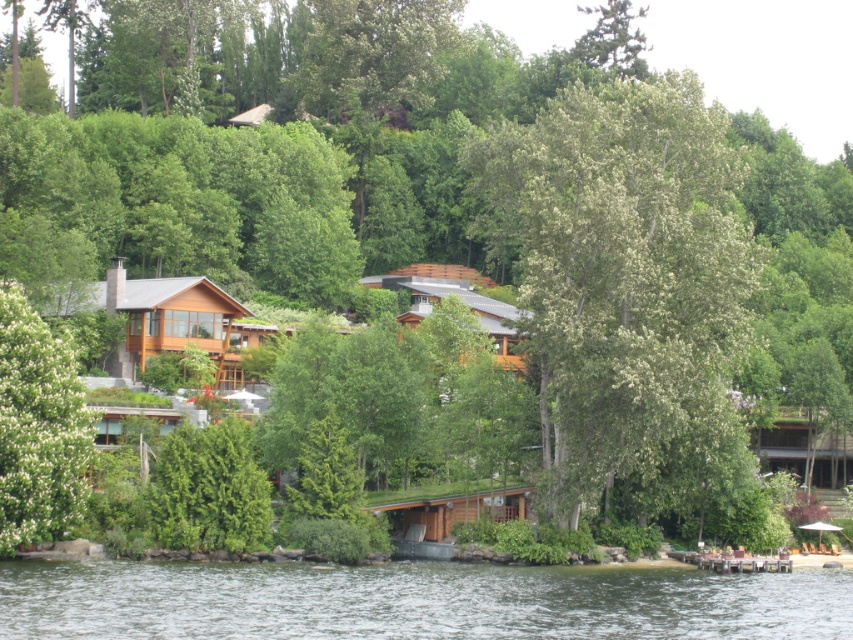
Is point (167, 436) positioned before point (775, 445)?

Yes, it is.

Is point (201, 536) farther from viewer compared to point (811, 461)?

No, (201, 536) is closer to viewer.

Find the location of a particular element. This screenshot has height=640, width=853. green textured tree at center is located at coordinates [209, 490].

Is green leafy tree at left taller than green textured tree at center?

Yes, green leafy tree at left is taller than green textured tree at center.

Can you confirm if green leafy tree at left is smaller than green textured tree at center?

Incorrect, green leafy tree at left is not smaller in size than green textured tree at center.

Measure the distance between point (47, 504) and camera.

The distance of point (47, 504) from camera is 262.12 feet.

What are the coordinates of `green leafy tree at left` in the screenshot? It's located at 38,428.

Is point (682, 566) positioned behind point (784, 413)?

No, it is not.

Who is higher up, dark blue water at lower left or brown wooden hut at lower right?

brown wooden hut at lower right is above.

Locate an element on the screen. The height and width of the screenshot is (640, 853). dark blue water at lower left is located at coordinates (415, 600).

I want to click on dark blue water at lower left, so click(x=415, y=600).